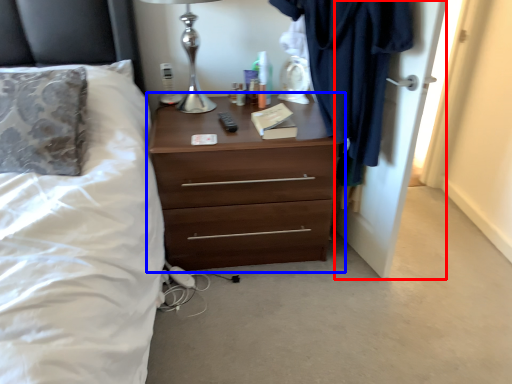
Question: Which point is further to the camera, door (highlighted by a red box) or chest of drawers (highlighted by a blue box)?

Choices:
 (A) door
 (B) chest of drawers

Answer: (B)